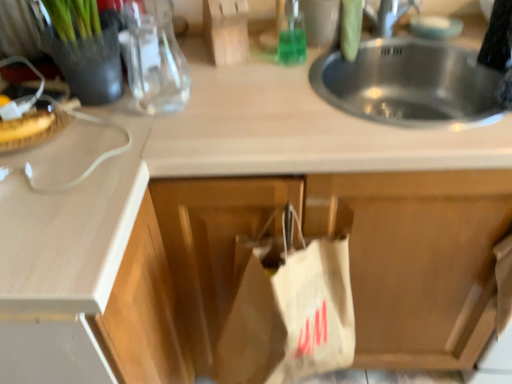
Locate an element on the screen. breadtexturedat left is located at coordinates (25, 125).

Image resolution: width=512 pixels, height=384 pixels. Identify the location of green glass bottle at upper center, which appears as the 2th bottle when viewed from the left. (291, 34).

Image resolution: width=512 pixels, height=384 pixels. What do you see at coordinates (154, 57) in the screenshot? I see `transparent glass bottle at upper left, which is the second bottle from back to front` at bounding box center [154, 57].

Identify the location of white matte cabinet at center. The width and height of the screenshot is (512, 384). (354, 254).

Considering their positions, is breadtexturedat left located in front of or behind green glass bottle at upper center, which appears as the 2th bottle when viewed from the left?

In the image, breadtexturedat left appears in front of green glass bottle at upper center, which appears as the 2th bottle when viewed from the left.

Find the location of `food in front of the green glass bottle at upper center, which appears as the 2th bottle when viewed from the left`. food in front of the green glass bottle at upper center, which appears as the 2th bottle when viewed from the left is located at coordinates (25, 125).

Is breadtexturedat left completely or partially outside of green glass bottle at upper center, which is the 2th bottle from front to back?

Yes, breadtexturedat left is not within green glass bottle at upper center, which is the 2th bottle from front to back.

Considering the positions of points (355, 302) and (150, 67), is point (355, 302) farther from camera compared to point (150, 67)?

Yes, it is.

Is white matte cabinet at center thinner than transparent glass bottle at upper left, the 1th bottle positioned from the left?

Incorrect, the width of white matte cabinet at center is not less than that of transparent glass bottle at upper left, the 1th bottle positioned from the left.

Which of these two, white matte cabinet at center or transparent glass bottle at upper left, arranged as the first bottle when viewed from the front, is bigger?

white matte cabinet at center.

Is white matte cabinet at center surrounding transparent glass bottle at upper left, the 1th bottle positioned from the left?

No.

Which is closer, (x=39, y=131) or (x=494, y=188)?

Point (x=494, y=188)

Looking at this image, what's the angular difference between breadtexturedat left and white matte cabinet at center's facing directions?

22.8 degrees.

From the image's perspective, is breadtexturedat left located above or below white matte cabinet at center?

From the image's perspective, breadtexturedat left appears above white matte cabinet at center.

From a real-world perspective, who is located higher, breadtexturedat left or white matte cabinet at center?

breadtexturedat left is physically above.

Is point (292, 282) more distant than point (291, 63)?

No, (292, 282) is closer to viewer.

Between white paper bag at center and green glass bottle at upper center, which appears as the 2th bottle when viewed from the left, which one has more height?

white paper bag at center.

Is white paper bag at center to the right of green glass bottle at upper center, which appears as the 2th bottle when viewed from the left, from the viewer's perspective?

No, white paper bag at center is not to the right of green glass bottle at upper center, which appears as the 2th bottle when viewed from the left.

Does white paper bag at center turn towards green glass bottle at upper center, which is the 2th bottle from front to back?

No, white paper bag at center is not facing towards green glass bottle at upper center, which is the 2th bottle from front to back.

Could you measure the distance between breadtexturedat left and transparent glass bottle at upper left, which appears as the 2th bottle when viewed from the right?

They are 11.38 inches apart.

Is breadtexturedat left touching transparent glass bottle at upper left, which appears as the 2th bottle when viewed from the right?

breadtexturedat left and transparent glass bottle at upper left, which appears as the 2th bottle when viewed from the right, are not in contact.

This screenshot has width=512, height=384. What are the coordinates of `bottle that is the 1st object to the right of the breadtexturedat left, starting at the anchor` in the screenshot? It's located at (154, 57).

Looking at this image, between breadtexturedat left and transparent glass bottle at upper left, arranged as the first bottle when viewed from the front, which one appears on the right side from the viewer's perspective?

Positioned to the right is transparent glass bottle at upper left, arranged as the first bottle when viewed from the front.

Between point (488, 176) and point (289, 256), which one is positioned in front?

Positioned in front is point (488, 176).

The height and width of the screenshot is (384, 512). I want to click on cabinetry on the right of white paper bag at center, so click(x=354, y=254).

Who is shorter, white matte cabinet at center or white paper bag at center?

white paper bag at center.

Which bottle is the 1st one when counting from the back of the white paper bag at center? Please provide its 2D coordinates.

[(154, 57)]

Which object is further away from the camera taking this photo, transparent glass bottle at upper left, arranged as the first bottle when viewed from the front, or white paper bag at center?

Positioned behind is transparent glass bottle at upper left, arranged as the first bottle when viewed from the front.

Can you confirm if transparent glass bottle at upper left, which is the second bottle from back to front, is positioned to the left of white paper bag at center?

Correct, you'll find transparent glass bottle at upper left, which is the second bottle from back to front, to the left of white paper bag at center.

Is transparent glass bottle at upper left, arranged as the first bottle when viewed from the front, facing towards white paper bag at center?

No, transparent glass bottle at upper left, arranged as the first bottle when viewed from the front, does not turn towards white paper bag at center.

Identify the location of food below the green glass bottle at upper center, which appears as the 2th bottle when viewed from the left (from a real-world perspective). (25, 125).

From a real-world perspective, starting from the white matte cabinet at center, which bottle is the 2nd one vertically above it? Please provide its 2D coordinates.

[(154, 57)]

Estimate the real-world distances between objects in this image. Which object is closer to white paper bag at center, transparent glass bottle at upper left, arranged as the first bottle when viewed from the front, or green glass bottle at upper center, which appears as the 2th bottle when viewed from the left?

Among the two, transparent glass bottle at upper left, arranged as the first bottle when viewed from the front, is located nearer to white paper bag at center.

Which object lies nearer to the anchor point transparent glass bottle at upper left, the 1th bottle positioned from the left, white paper bag at center or breadtexturedat left?

breadtexturedat left is closer to transparent glass bottle at upper left, the 1th bottle positioned from the left.

Which object lies further to the anchor point white paper bag at center, green glass bottle at upper center, which appears as the 1th bottle when viewed from the back, or white matte cabinet at center?

green glass bottle at upper center, which appears as the 1th bottle when viewed from the back, is positioned further to the anchor white paper bag at center.

Which object lies nearer to the anchor point breadtexturedat left, white matte cabinet at center or transparent glass bottle at upper left, which appears as the 2th bottle when viewed from the right?

The object closer to breadtexturedat left is transparent glass bottle at upper left, which appears as the 2th bottle when viewed from the right.

Considering their positions, is green glass bottle at upper center, the 1th bottle viewed from the right, positioned closer to breadtexturedat left than white matte cabinet at center?

Based on the image, green glass bottle at upper center, the 1th bottle viewed from the right, appears to be nearer to breadtexturedat left.

Looking at the image, which one is located closer to green glass bottle at upper center, which is the 2th bottle from front to back, white paper bag at center or breadtexturedat left?

Based on the image, white paper bag at center appears to be nearer to green glass bottle at upper center, which is the 2th bottle from front to back.

From the image, which object appears to be nearer to transparent glass bottle at upper left, the 1th bottle positioned from the left, breadtexturedat left or white paper bag at center?

breadtexturedat left is closer to transparent glass bottle at upper left, the 1th bottle positioned from the left.

When comparing their distances from white paper bag at center, does transparent glass bottle at upper left, which appears as the 2th bottle when viewed from the right, or breadtexturedat left seem closer?

Based on the image, transparent glass bottle at upper left, which appears as the 2th bottle when viewed from the right, appears to be nearer to white paper bag at center.

Identify the location of grocery bag between breadtexturedat left and white matte cabinet at center. (289, 305).

I want to click on bottle between green glass bottle at upper center, which appears as the 1th bottle when viewed from the back, and white paper bag at center from top to bottom, so click(x=154, y=57).

The height and width of the screenshot is (384, 512). What are the coordinates of `cabinetry between green glass bottle at upper center, which appears as the 1th bottle when viewed from the back, and white paper bag at center from top to bottom` in the screenshot? It's located at (354, 254).

Locate an element on the screen. bottle located between transparent glass bottle at upper left, which is the second bottle from back to front, and white matte cabinet at center in the left-right direction is located at coordinates (291, 34).